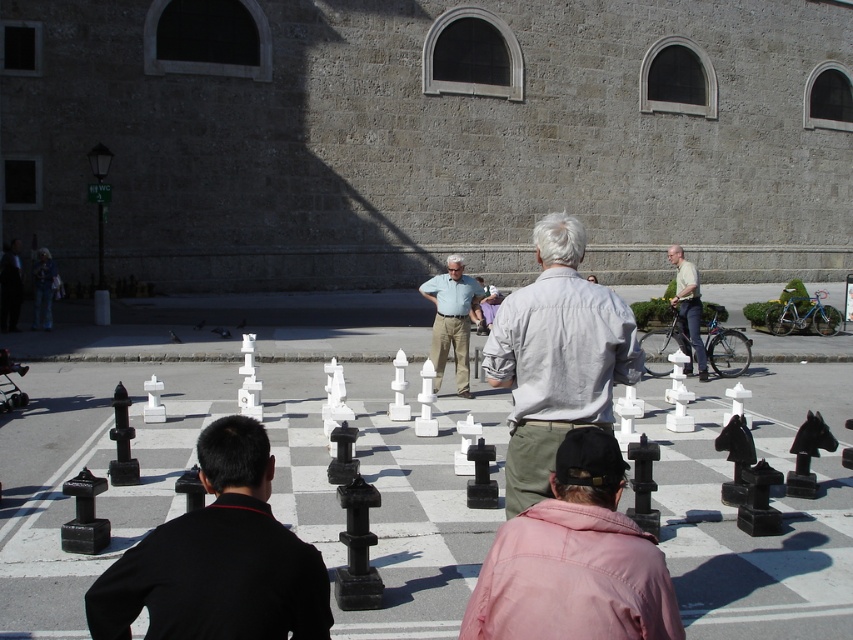
Which is behind, point (599, 420) or point (688, 269)?

The point (688, 269) is more distant.

The width and height of the screenshot is (853, 640). Find the location of `light gray shirt at center`. light gray shirt at center is located at coordinates (556, 356).

Can you confirm if light blue shirt at center is smaller than light beige shirt at center?

Yes.

Who is more distant from viewer, (462, 340) or (701, 369)?

The point (701, 369) is behind.

Where is `light blue shirt at center`? light blue shirt at center is located at coordinates (451, 321).

Is the position of black matte chess piece at lower left more distant than that of light beige shirt at center?

No, it is not.

Is black matte chess piece at lower left positioned before light beige shirt at center?

Yes, black matte chess piece at lower left is in front of light beige shirt at center.

Is point (241, 476) farther from viewer compared to point (688, 280)?

No, (241, 476) is closer to viewer.

Identify the location of black matte chess piece at lower left. (218, 557).